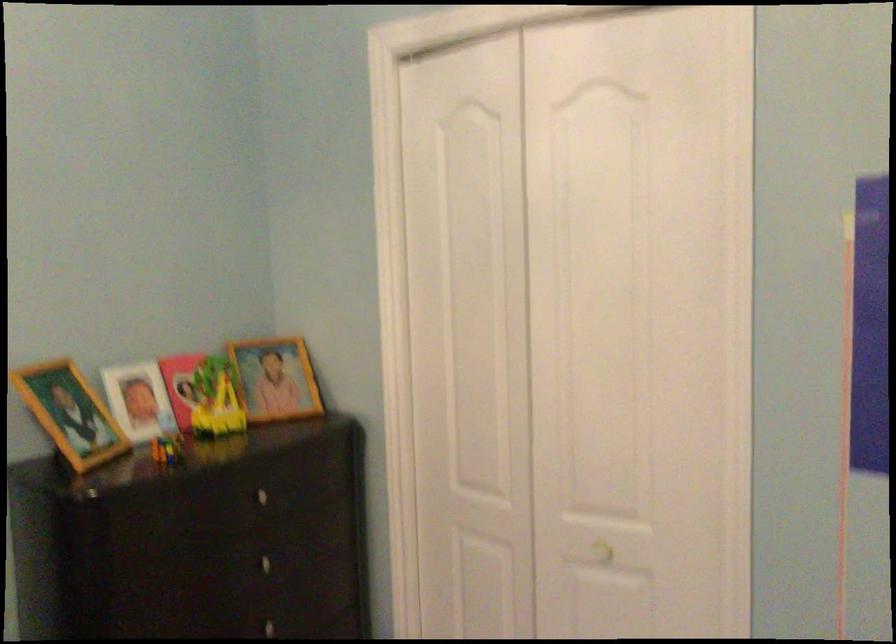
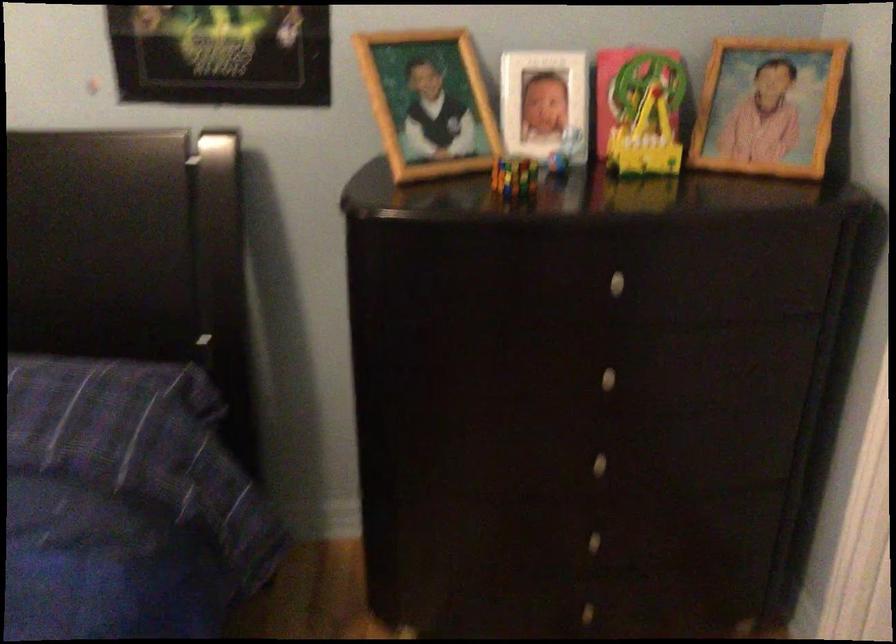
How did the camera likely rotate?

The camera rotated toward left-down.